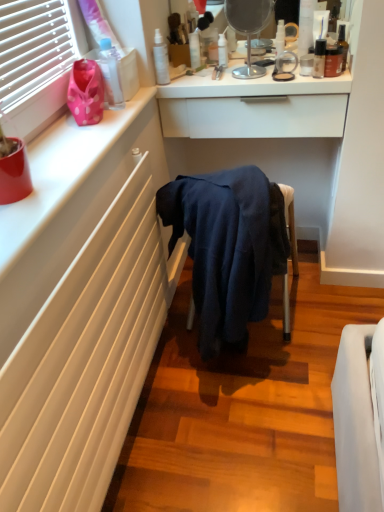
Locate an element on the screen. This screenshot has height=512, width=384. vacant area that is in front of white glossy bottle at upper center, the fourth toiletry when ordered from right to left is located at coordinates (281, 69).